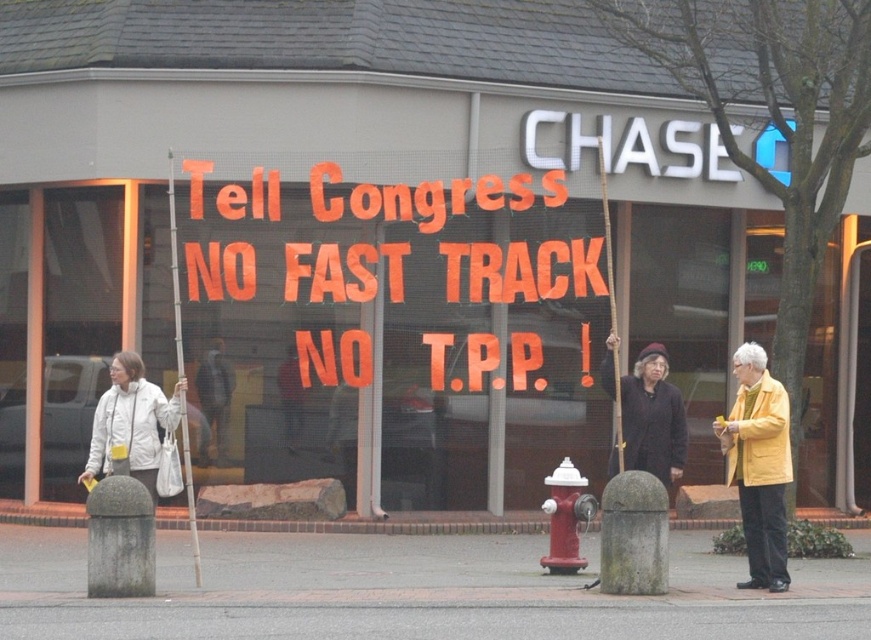
Question: Which point is closer to the camera taking this photo?

Choices:
 (A) (217, 394)
 (B) (716, 420)

Answer: (B)

Question: Which object is farther from the camera taking this photo?

Choices:
 (A) gray concrete pavement at lower center
 (B) metallic ladder at left

Answer: (B)

Question: Can you confirm if dark gray jacket at center is smaller than metallic ladder at left?

Choices:
 (A) yes
 (B) no

Answer: (B)

Question: Which object is the farthest from the gray concrete pavement at lower center?

Choices:
 (A) white matte jacket at lower left
 (B) metallic ladder at left
 (C) yellow matte jacket at right
 (D) dark gray jacket at center

Answer: (B)

Question: Can you confirm if dark gray jacket at center is thinner than metallic ladder at left?

Choices:
 (A) yes
 (B) no

Answer: (B)

Question: Can you confirm if yellow matte jacket at right is thinner than white matte jacket at lower left?

Choices:
 (A) no
 (B) yes

Answer: (B)